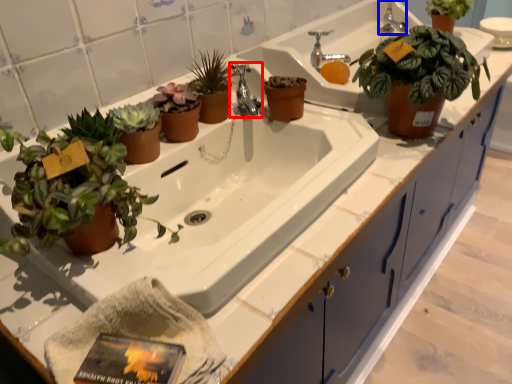
Question: Among these objects, which one is farthest to the camera, tap (highlighted by a red box) or faucet (highlighted by a blue box)?

Choices:
 (A) tap
 (B) faucet

Answer: (B)